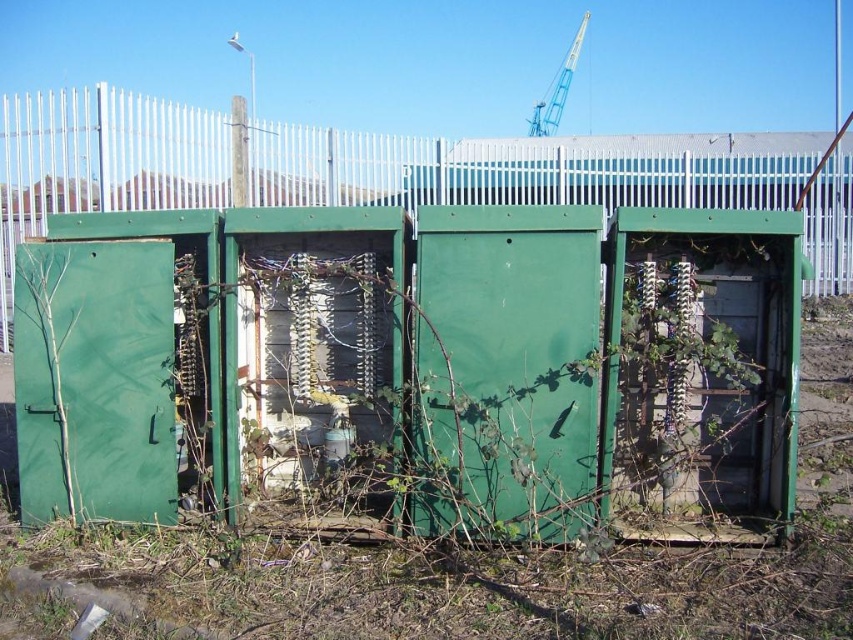
You are a construction worker who needs to cross from the area with the green electrical cabinets to the yellow metallic crane at upper center. The green painted metal fence at center is blocking your path. Can you safely walk around the fence to reach the crane without going through the fence?

The green painted metal fence at center and yellow metallic crane at upper center are 37.17 feet apart from each other. Since the fence is blocking the path, you can walk around it as long as there is enough space to navigate around the fence to reach the crane within the 37.17 feet distance between them.

You are a maintenance worker standing 3 meters away from the green painted metal fence at center. You need to reach the fence to inspect it. Can you walk directly to the fence without needing to move any obstacles?

The distance between the green painted metal fence at center and the viewer is 3.83 meters. Since you are already 3 meters away, you can walk the remaining 0.83 meters to reach it without needing to move any obstacles.

In the scene shown: You are standing in front of the green electrical cabinets and want to locate the green painted metal fence at center. Where would you look relative to your position?

The green painted metal fence at center is located at the central part of the scene, specifically at coordinates approximately 0.264 on the x axis and 0.620 on the y axis.